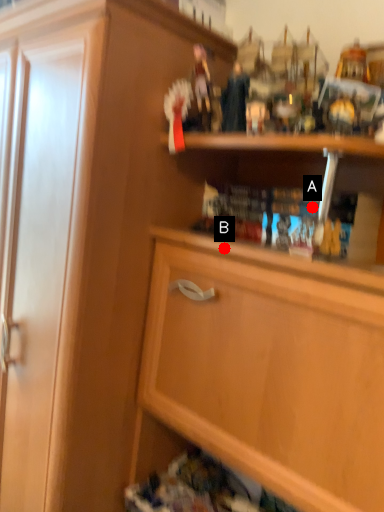
Question: Two points are circled on the image, labeled by A and B beside each circle. Which point is farther to the camera?

Choices:
 (A) A is further
 (B) B is further

Answer: (A)